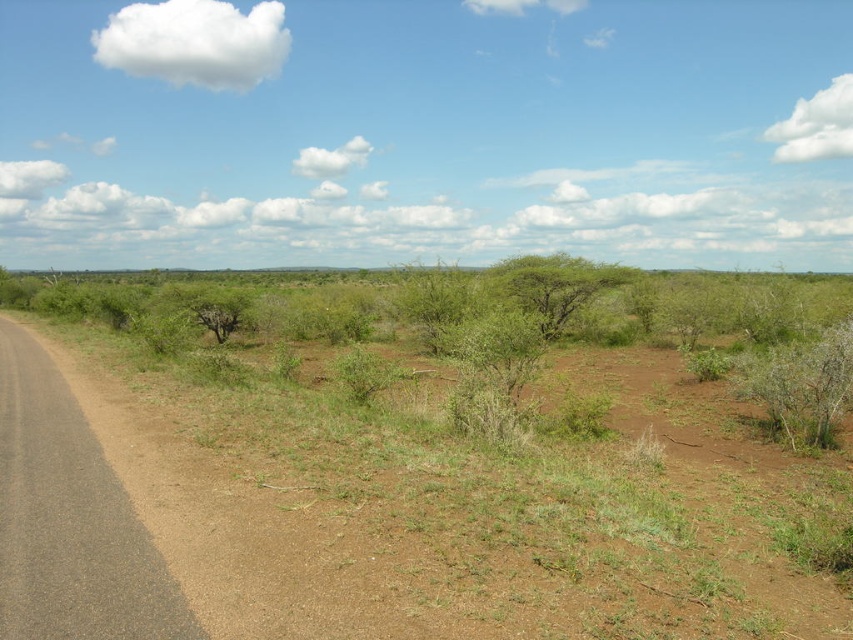
Question: Can you confirm if green leafy bush at right is positioned below green leafy bush at center?

Choices:
 (A) no
 (B) yes

Answer: (B)

Question: Which object appears farthest from the camera in this image?

Choices:
 (A) green leafy bush at right
 (B) green leafy bush at center

Answer: (B)

Question: Does green leafy bush at right appear on the right side of green leafy bush at center?

Choices:
 (A) no
 (B) yes

Answer: (B)

Question: Is green leafy bush at right smaller than green leafy bush at center?

Choices:
 (A) yes
 (B) no

Answer: (A)